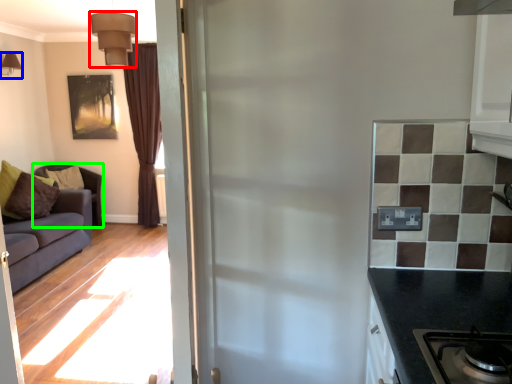
Question: Estimate the real-world distances between objects in this image. Which object is closer to lamp (highlighted by a red box), lamp (highlighted by a blue box) or studio couch (highlighted by a green box)?

Choices:
 (A) lamp
 (B) studio couch

Answer: (A)